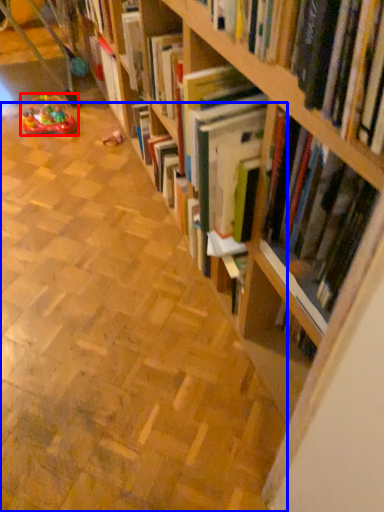
Question: Which of the following is the closest to the observer, toy (highlighted by a red box) or aisle (highlighted by a blue box)?

Choices:
 (A) toy
 (B) aisle

Answer: (B)